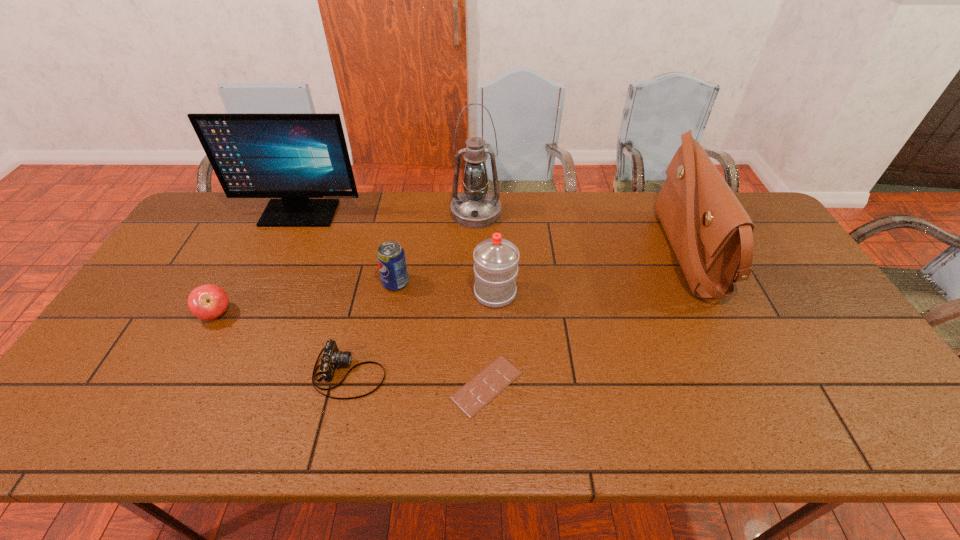
The image size is (960, 540). In order to click on free spot between the second shortest object and the apple in this screenshot , I will do `click(283, 343)`.

Identify which object is the fifth nearest to the third tallest object. Please provide its 2D coordinates. Your answer should be formatted as a tuple, i.e. [(x, y)], where the tuple contains the x and y coordinates of a point satisfying the conditions above.

[(331, 358)]

Where is `the seventh closest object to the fifth shortest object`? the seventh closest object to the fifth shortest object is located at coordinates (208, 301).

Image resolution: width=960 pixels, height=540 pixels. In order to click on vacant space that satisfies the following two spatial constraints: 1. on the screen side of the shortest object; 2. on the left side of the monitor in this screenshot , I will do `click(221, 385)`.

Locate an element on the screen. Image resolution: width=960 pixels, height=540 pixels. free point that satisfies the following two spatial constraints: 1. on the front side of the fourth shortest object; 2. on the front-facing side of the camera is located at coordinates (379, 373).

You are a GUI agent. You are given a task and a screenshot of the screen. Output one action in this format:
    pyautogui.click(x=<x>, y=<y>)
    Task: Click on the vacant space that satisfies the following two spatial constraints: 1. on the back side of the third shortest object; 2. on the left side of the oil lamp
    This screenshot has width=960, height=540.
    Given the screenshot: What is the action you would take?
    pyautogui.click(x=270, y=212)

You are a GUI agent. You are given a task and a screenshot of the screen. Output one action in this format:
    pyautogui.click(x=<x>, y=<y>)
    Task: Click on the free space in the image that satisfies the following two spatial constraints: 1. on the front side of the fifth tallest object; 2. on the right side of the chocolate bar
    Image resolution: width=960 pixels, height=540 pixels.
    Given the screenshot: What is the action you would take?
    pyautogui.click(x=377, y=385)